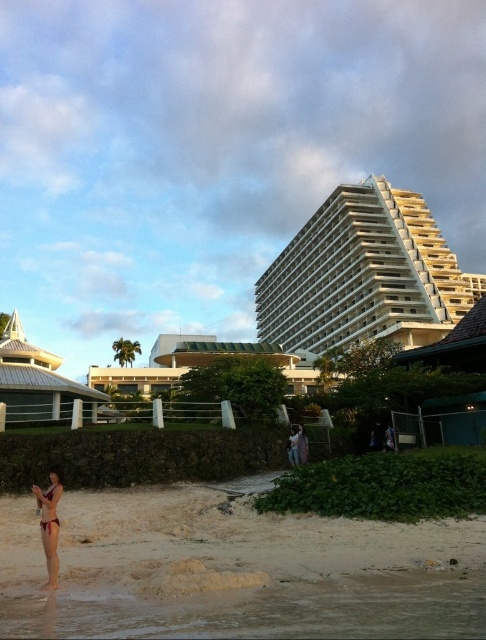
You are standing at the center of the beach scene. Which direction should you walk to reach the beige sand at lower left?

The beige sand at lower left is located at point (x=236, y=570), so you should walk towards the lower left direction to reach it.

You are a photographer trying to capture the white textured dome at left and the matte pink bikini at lower left in the same frame. Based on their positions, which object should you focus on first to ensure both are in the shot?

The white textured dome at left is positioned on the left side of matte pink bikini at lower left, so you should focus on the white textured dome at left first to ensure both objects are within the frame.

You are standing on the beach and want to place a small bucket between the beige sand at lower left and the dark red bikini at lower left. Which object should you place the bucket closer to so that it doesn

The beige sand at lower left is wider than the dark red bikini at lower left, so you should place the bucket closer to the dark red bikini at lower left to ensure it fits within the space between them.